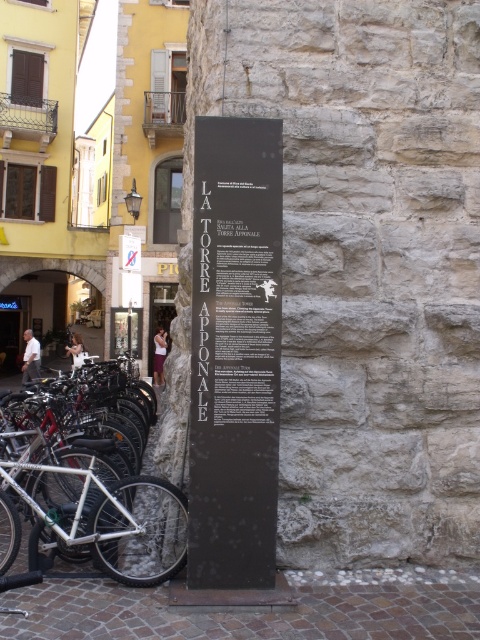
You are a tourist holding a map and trying to locate the historical stone wall on the right. You see the black polished stone sign at center and the silver metallic bicycle at left. Which object is closer to the historical stone wall on the right?

The black polished stone sign at center is closer to the historical stone wall on the right because it is positioned in front of it, while the silver metallic bicycle at left is located to the side, farther away from the wall.